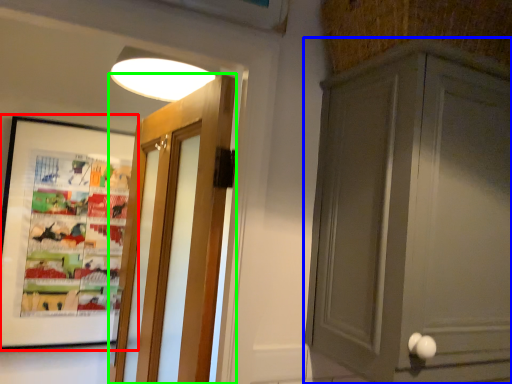
Question: Which is nearer to the picture frame (highlighted by a red box)? cabinetry (highlighted by a blue box) or door (highlighted by a green box).

Choices:
 (A) cabinetry
 (B) door

Answer: (B)